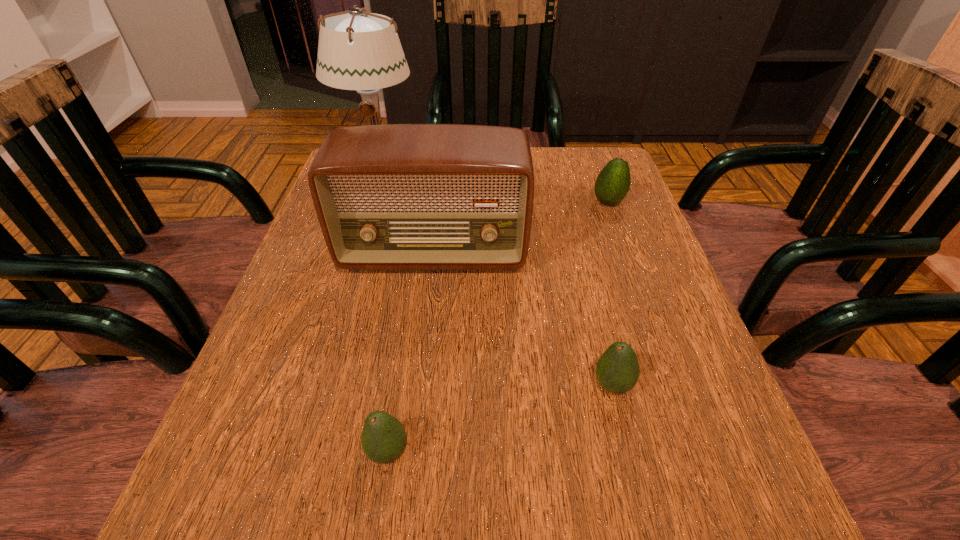
The height and width of the screenshot is (540, 960). I want to click on the farthest object, so click(x=357, y=50).

This screenshot has width=960, height=540. Identify the location of the tallest object. (357, 50).

Find the location of a particular element. The height and width of the screenshot is (540, 960). the third farthest object is located at coordinates (399, 196).

Identify the location of radio receiver. The width and height of the screenshot is (960, 540). (399, 196).

What are the coordinates of `the third tallest object` in the screenshot? It's located at [613, 182].

At what (x,y) coordinates should I click in order to perform the action: click on the rightmost avocado. Please return your answer as a coordinate pair (x, y). The height and width of the screenshot is (540, 960). Looking at the image, I should click on (613, 182).

Where is `the second object from right to left`? The height and width of the screenshot is (540, 960). the second object from right to left is located at coordinates (617, 371).

Where is `the fourth farthest object`? the fourth farthest object is located at coordinates (617, 371).

Identify the location of the nearest object. (384, 438).

I want to click on the leftmost avocado, so click(x=384, y=438).